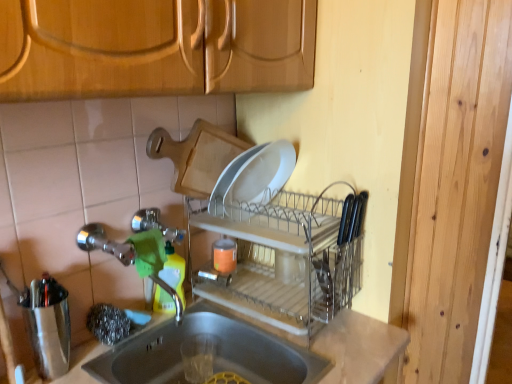
Question: From a real-world perspective, is green plastic bottle at sink beneath brushed metal shaker at left?

Choices:
 (A) yes
 (B) no

Answer: (A)

Question: Does green plastic bottle at sink have a smaller size compared to brushed metal shaker at left?

Choices:
 (A) yes
 (B) no

Answer: (A)

Question: Considering the relative positions of green plastic bottle at sink and brushed metal shaker at left in the image provided, is green plastic bottle at sink behind brushed metal shaker at left?

Choices:
 (A) no
 (B) yes

Answer: (B)

Question: Is green plastic bottle at sink positioned with its back to brushed metal shaker at left?

Choices:
 (A) no
 (B) yes

Answer: (A)

Question: Is green plastic bottle at sink outside brushed metal shaker at left?

Choices:
 (A) yes
 (B) no

Answer: (A)

Question: Considering the relative positions of green plastic bottle at sink and brushed metal shaker at left in the image provided, is green plastic bottle at sink to the left or to the right of brushed metal shaker at left?

Choices:
 (A) right
 (B) left

Answer: (A)

Question: Does point (174, 264) appear closer or farther from the camera than point (49, 304)?

Choices:
 (A) farther
 (B) closer

Answer: (A)

Question: Relative to brushed metal shaker at left, is green plastic bottle at sink in front or behind?

Choices:
 (A) front
 (B) behind

Answer: (B)

Question: Considering the positions of green plastic bottle at sink and brushed metal shaker at left in the image, is green plastic bottle at sink wider or thinner than brushed metal shaker at left?

Choices:
 (A) wide
 (B) thin

Answer: (B)

Question: Is point (282, 352) closer or farther from the camera than point (178, 261)?

Choices:
 (A) closer
 (B) farther

Answer: (A)

Question: From the image's perspective, is smooth gray sink at lower center positioned above or below green plastic bottle at sink?

Choices:
 (A) above
 (B) below

Answer: (B)

Question: Looking at the image, does smooth gray sink at lower center seem bigger or smaller compared to green plastic bottle at sink?

Choices:
 (A) big
 (B) small

Answer: (A)

Question: From a real-world perspective, is smooth gray sink at lower center physically located above or below green plastic bottle at sink?

Choices:
 (A) above
 (B) below

Answer: (B)

Question: Choose the correct answer: Is clear plastic dish rack at center inside brushed metal shaker at left or outside it?

Choices:
 (A) inside
 (B) outside

Answer: (B)

Question: From the image's perspective, is clear plastic dish rack at center above or below brushed metal shaker at left?

Choices:
 (A) above
 (B) below

Answer: (A)